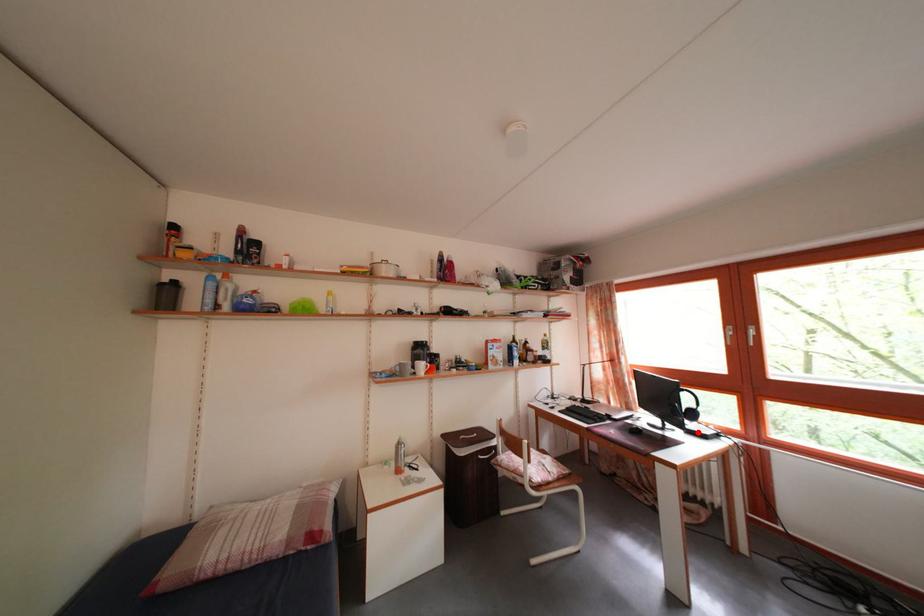
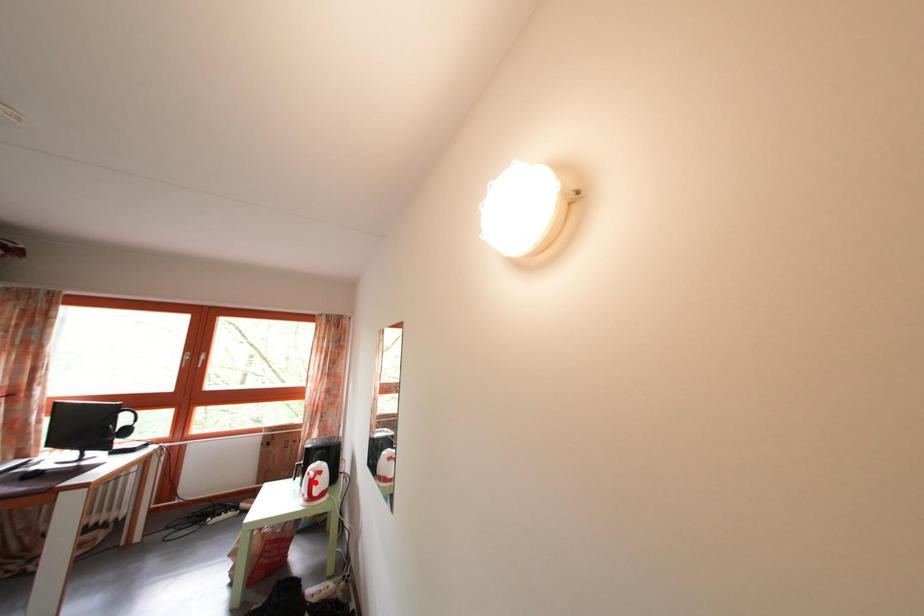
I am providing you with two images of the same scene from different viewpoints. A red point is marked on the first image and another point is marked on the second image. Is the marked point in image1 the same physical position as the marked point in image2?

No